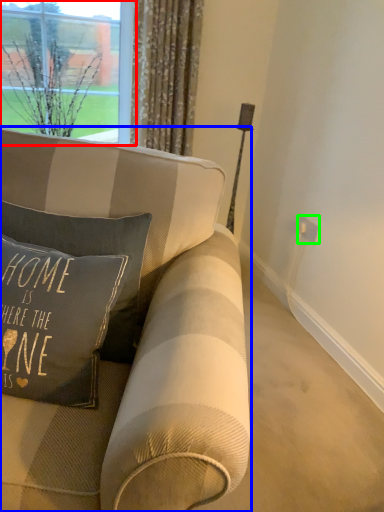
Question: Estimate the real-world distances between objects in this image. Which object is farther from window (highlighted by a red box), studio couch (highlighted by a blue box) or electric outlet (highlighted by a green box)?

Choices:
 (A) studio couch
 (B) electric outlet

Answer: (B)